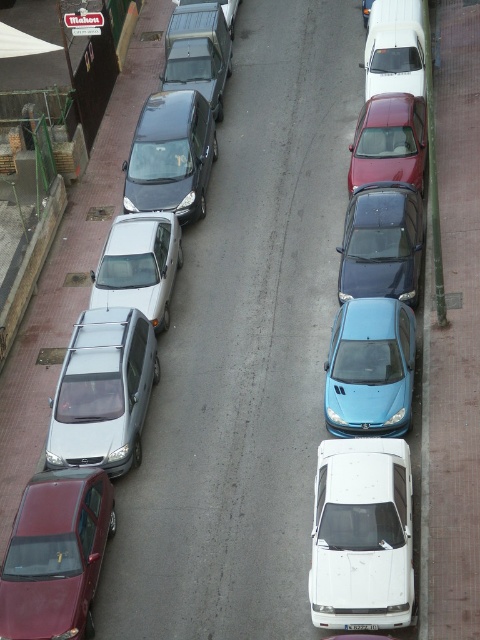
Question: Does metallic blue sedan at center have a greater width compared to white glossy car at left?

Choices:
 (A) yes
 (B) no

Answer: (A)

Question: Which object is farther from the camera taking this photo?

Choices:
 (A) shiny red car at center
 (B) satin silver van at center-left
 (C) maroon matte car at lower left

Answer: (A)

Question: Based on their relative distances, which object is nearer to the shiny red car at center?

Choices:
 (A) white glossy van at upper right
 (B) satin silver van at center-left
 (C) white plastic license plate at center

Answer: (A)

Question: Which of the following is the closest to the observer?

Choices:
 (A) (400, 29)
 (B) (377, 627)
 (C) (120, 216)

Answer: (B)

Question: Can you confirm if white matte car at center is positioned to the right of matte blue car at center?

Choices:
 (A) yes
 (B) no

Answer: (B)

Question: Where is white glossy car at left located in relation to shiny red car at center in the image?

Choices:
 (A) below
 (B) above

Answer: (A)